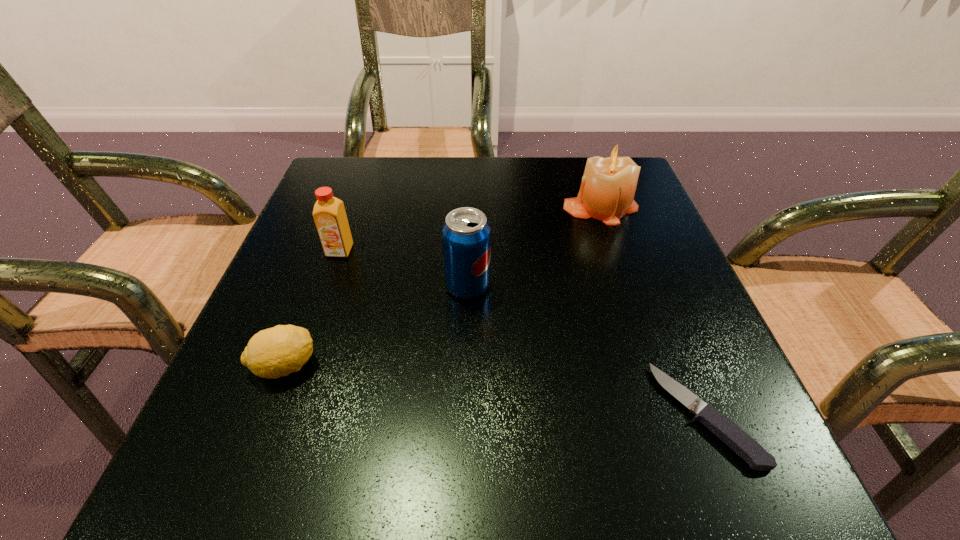
Where is `vacant space in between the steak knife and the farthest object`? vacant space in between the steak knife and the farthest object is located at coordinates (653, 310).

You are a GUI agent. You are given a task and a screenshot of the screen. Output one action in this format:
    pyautogui.click(x=<x>, y=<y>)
    Task: Click on the free space between the shortest object and the third object from right to left
    This screenshot has height=540, width=960.
    Given the screenshot: What is the action you would take?
    pyautogui.click(x=587, y=350)

Locate an element on the screen. Image resolution: width=960 pixels, height=540 pixels. unoccupied position between the third nearest object and the steak knife is located at coordinates (587, 350).

Identify which object is the fourth nearest to the orange juice. Please provide its 2D coordinates. Your answer should be formatted as a tuple, i.e. [(x, y)], where the tuple contains the x and y coordinates of a point satisfying the conditions above.

[(726, 430)]

Identify which object is the nearest to the third farthest object. Please provide its 2D coordinates. Your answer should be formatted as a tuple, i.e. [(x, y)], where the tuple contains the x and y coordinates of a point satisfying the conditions above.

[(329, 214)]

Where is `free point that satisfies the following two spatial constraints: 1. at the stem end of the shortest object; 2. on the right side of the fourth tallest object`? The width and height of the screenshot is (960, 540). free point that satisfies the following two spatial constraints: 1. at the stem end of the shortest object; 2. on the right side of the fourth tallest object is located at coordinates (267, 414).

The image size is (960, 540). I want to click on blank space that satisfies the following two spatial constraints: 1. on the front and back of the orange juice; 2. at the stem end of the lemon, so click(300, 366).

Find the location of `blank space that satisfies the following two spatial constraints: 1. on the front and back of the orange juice; 2. on the right side of the pop soda`. blank space that satisfies the following two spatial constraints: 1. on the front and back of the orange juice; 2. on the right side of the pop soda is located at coordinates (327, 286).

Identify the location of vacant region that satisfies the following two spatial constraints: 1. at the stem end of the lemon; 2. on the right side of the steak knife. This screenshot has width=960, height=540. [x=267, y=414].

Find the location of a particular element. This screenshot has width=960, height=540. vacant point that satisfies the following two spatial constraints: 1. on the front and back of the fourth nearest object; 2. at the stem end of the second shortest object is located at coordinates (300, 366).